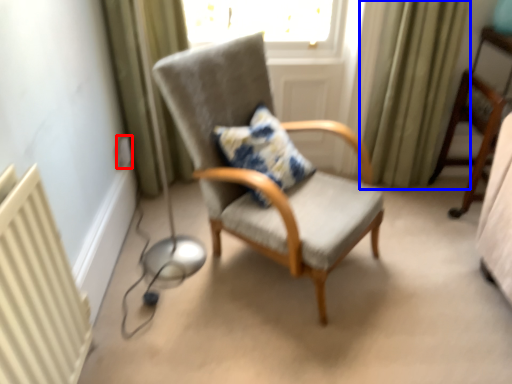
Question: Which object appears closest to the camera in this image, electric outlet (highlighted by a red box) or curtain (highlighted by a blue box)?

Choices:
 (A) electric outlet
 (B) curtain

Answer: (B)